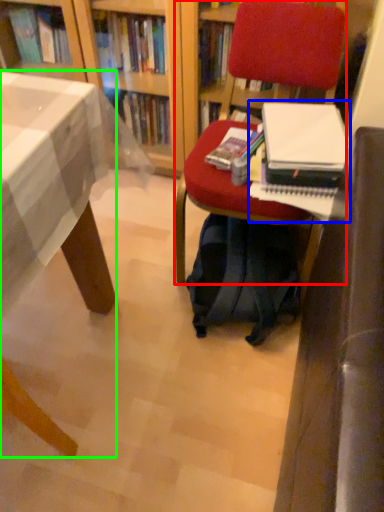
Question: Which object is the farthest from chair (highlighted by a red box)? Choose among these: paperback book (highlighted by a blue box) or desk (highlighted by a green box).

Choices:
 (A) paperback book
 (B) desk

Answer: (B)